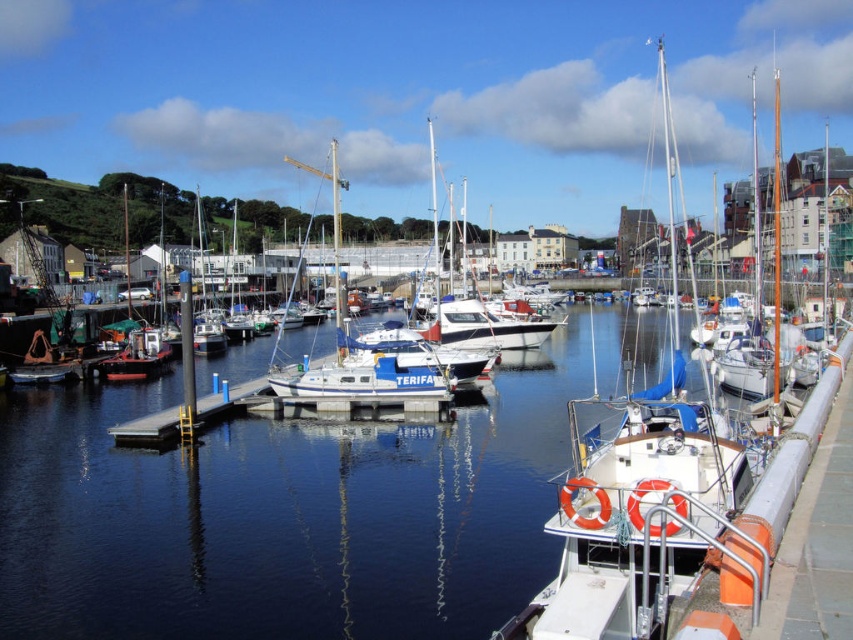
Between point (231, 604) and point (438, 300), which one is positioned in front?

Positioned in front is point (231, 604).

Where is `clear water at center`? The height and width of the screenshot is (640, 853). clear water at center is located at coordinates (282, 515).

Is point (525, 502) in front of point (468, 380)?

Yes.

Where is `clear water at center`? Image resolution: width=853 pixels, height=640 pixels. clear water at center is located at coordinates (282, 515).

Can you confirm if clear water at center is positioned below blue matte sailboat at center?

Yes, clear water at center is below blue matte sailboat at center.

Does clear water at center come behind blue matte sailboat at center?

No, it is in front of blue matte sailboat at center.

Describe the element at coordinates (282, 515) in the screenshot. The height and width of the screenshot is (640, 853). I see `clear water at center` at that location.

The height and width of the screenshot is (640, 853). Find the location of `clear water at center`. clear water at center is located at coordinates (282, 515).

Between white matte sailboat at center and white glossy sailboat at right, which one is positioned lower?

white matte sailboat at center is lower down.

At what (x,y) coordinates should I click in order to perform the action: click on white matte sailboat at center. Please return your answer as a coordinate pair (x, y). Looking at the image, I should click on (643, 499).

Does point (572, 404) come in front of point (775, 100)?

Yes, point (572, 404) is in front of point (775, 100).

Where is `white matte sailboat at center`? The height and width of the screenshot is (640, 853). white matte sailboat at center is located at coordinates (643, 499).